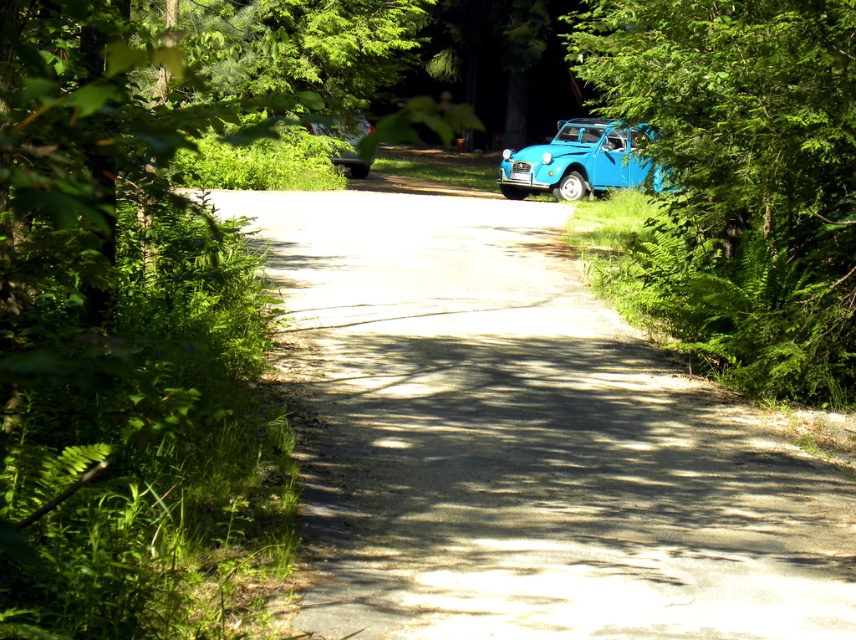
The image size is (856, 640). Describe the element at coordinates (522, 442) in the screenshot. I see `smooth asphalt driveway at center` at that location.

Is smooth asphalt driveway at center to the left of metallic silver car at center from the viewer's perspective?

In fact, smooth asphalt driveway at center is to the right of metallic silver car at center.

Between point (424, 356) and point (361, 176), which one is positioned in front?

Point (424, 356) is more forward.

Identify the location of smooth asphalt driveway at center. click(x=522, y=442).

Which of these two, smooth asphalt driveway at center or green leafy tree at right, stands shorter?

smooth asphalt driveway at center is shorter.

Who is more forward, (399, 568) or (664, 257)?

Positioned in front is point (399, 568).

Is point (811, 481) positioned before point (767, 134)?

Yes, it is in front of point (767, 134).

You are a GUI agent. You are given a task and a screenshot of the screen. Output one action in this format:
    pyautogui.click(x=<x>, y=<y>)
    Task: Click on the smooth asphalt driveway at center
    This screenshot has height=640, width=856.
    Given the screenshot: What is the action you would take?
    pyautogui.click(x=522, y=442)

Measure the distance between smooth asphalt driveway at center and blue matte car at right.

They are 7.34 meters apart.

Between smooth asphalt driveway at center and blue matte car at right, which one appears on the right side from the viewer's perspective?

Positioned to the right is blue matte car at right.

In order to click on smooth asphalt driveway at center in this screenshot , I will do `click(522, 442)`.